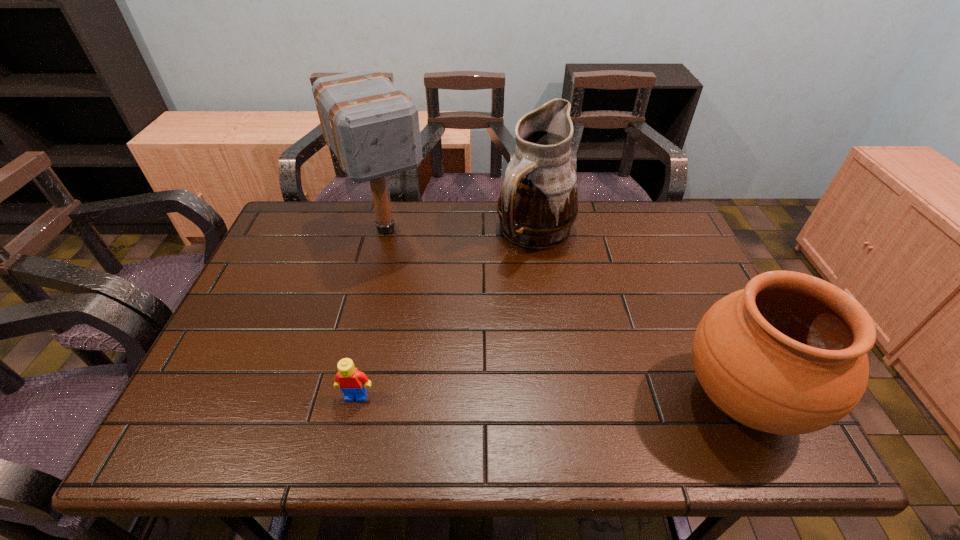
Locate an element on the screen. This screenshot has width=960, height=540. free spot on the desktop that is between the Lego and the rightmost object and is positioned from the spout of the third shortest object is located at coordinates (575, 397).

You are a GUI agent. You are given a task and a screenshot of the screen. Output one action in this format:
    pyautogui.click(x=<x>, y=<y>)
    Task: Click on the free spot on the desktop that is between the Lego and the rightmost object and is positioned on the striking surface of the mallet
    The width and height of the screenshot is (960, 540).
    Given the screenshot: What is the action you would take?
    pyautogui.click(x=492, y=397)